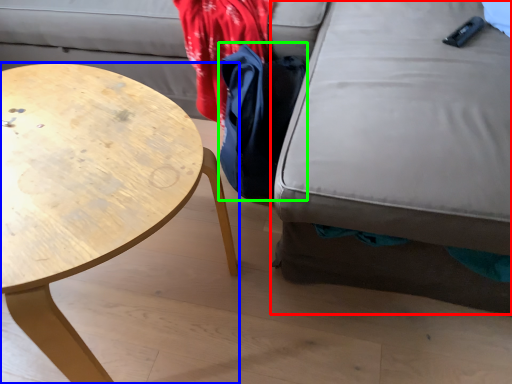
Question: Estimate the real-world distances between objects in this image. Which object is closer to swivel chair (highlighted by a red box), coffee table (highlighted by a blue box) or cloak (highlighted by a green box)?

Choices:
 (A) coffee table
 (B) cloak

Answer: (B)